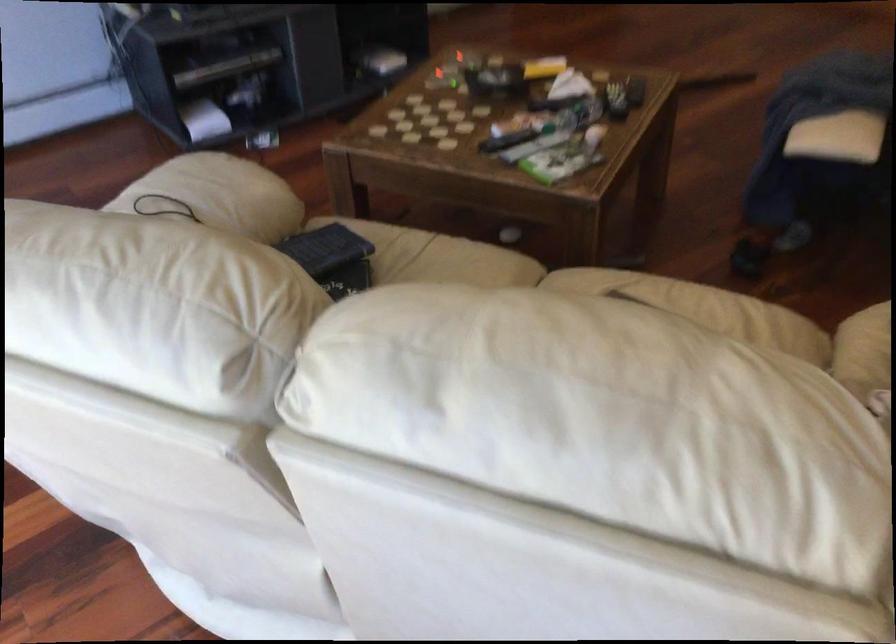
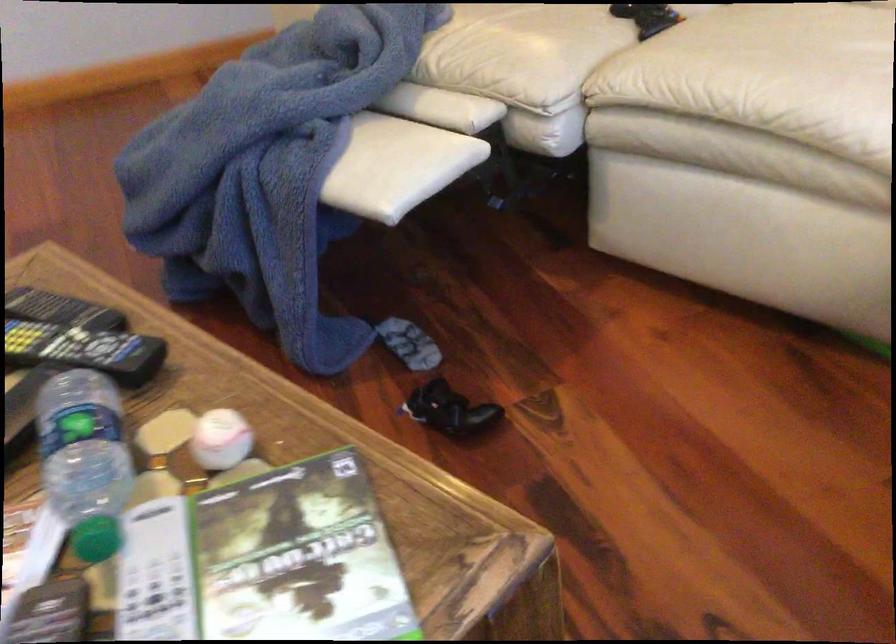
Find the pixel in the second image that matches (x=533, y=133) in the first image.

(156, 574)